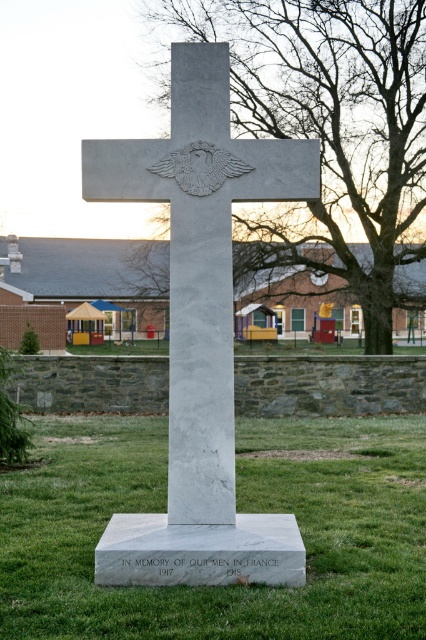
You are a groundskeeper responsible for maintaining the monument. You need to place a 2m wide flower bed around the white marble cross at center. Given the green grass at center, will there be enough space to accommodate the flower bed?

The green grass at center is wider than the white marble cross at center. Since the grass area is wider, there should be sufficient space to place a 2m wide flower bed around the white marble cross at center without encroaching beyond the grass area.

You are a maintenance worker who needs to mow the lawn between the green grass at center and the white marble cross at center. Can you use a standard lawn mower that has a 4 feet width? Please explain your reasoning based on the distance provided.

The distance between the green grass at center and the white marble cross at center is 7.83 feet. A standard lawn mower with a 4 feet width can navigate this space since 4 feet is less than 7.83 feet. Therefore, the mower can fit comfortably between them without any issues.